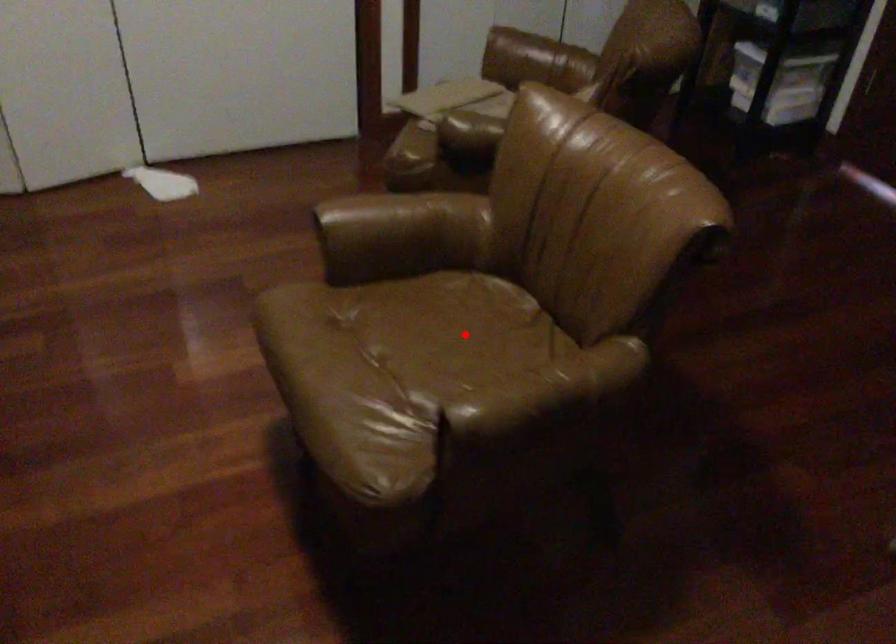
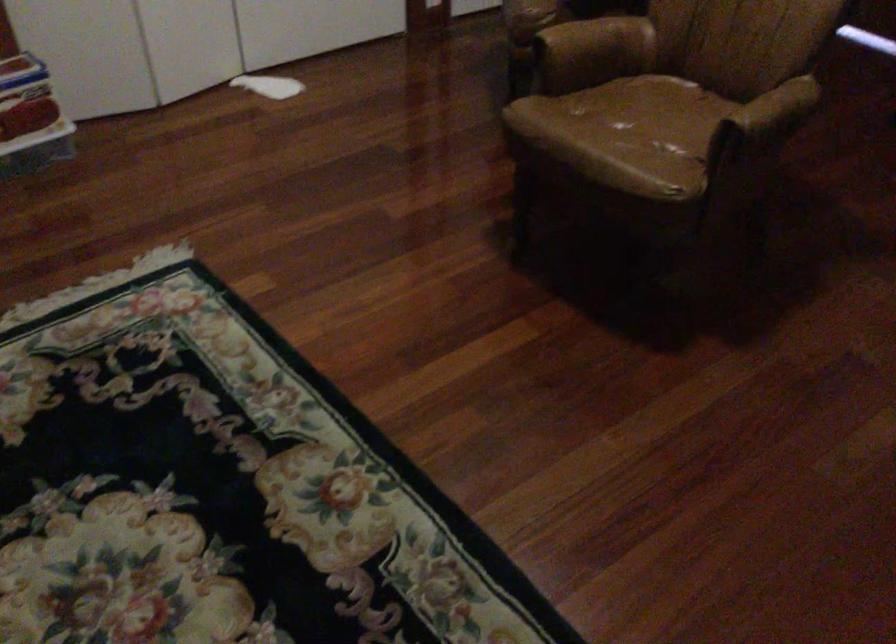
The point at the highlighted location is marked in the first image. Where is the corresponding point in the second image?

(661, 109)